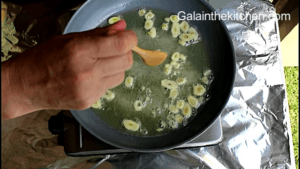
Find the location of a particular element. The image size is (300, 169). black knob on cooker is located at coordinates (64, 121).